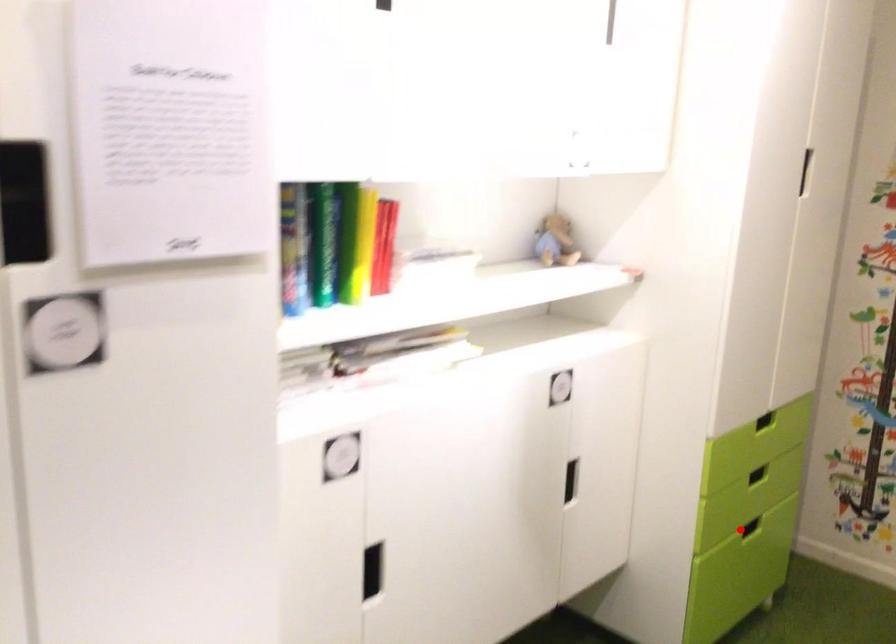
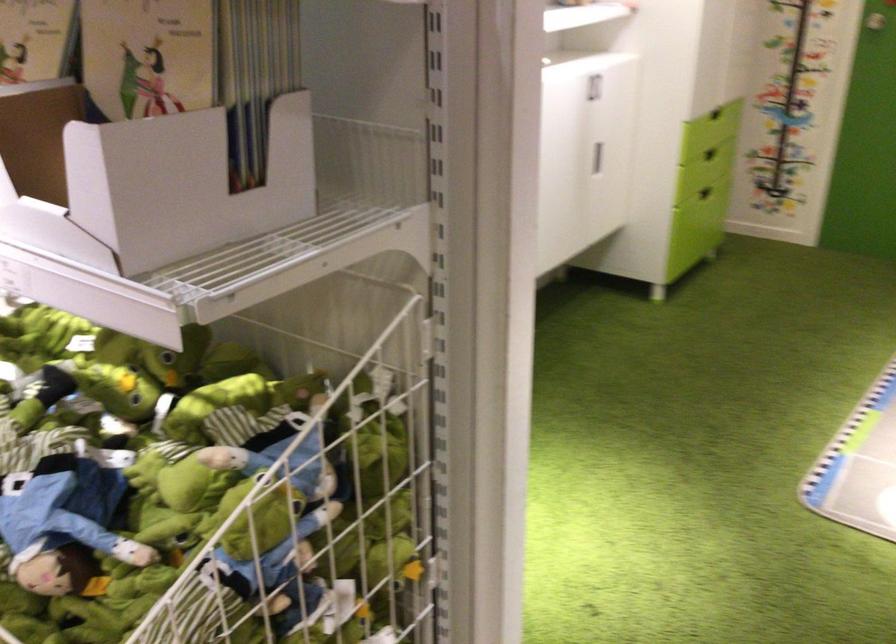
Question: A red point is marked in image1. In image2, is the corresponding 3D point closer to the camera or farther? Reply with the corresponding letter.

Choices:
 (A) The corresponding 3D point is closer.
 (B) The corresponding 3D point is farther.

Answer: (B)